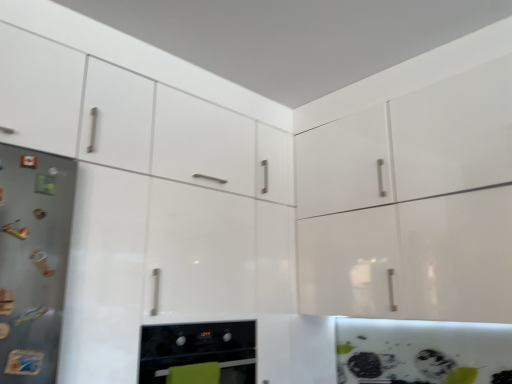
The image size is (512, 384). What do you see at coordinates (33, 260) in the screenshot?
I see `satin steel refrigerator at left` at bounding box center [33, 260].

Identify the location of satin steel refrigerator at left. (33, 260).

Locate an element on the screen. The height and width of the screenshot is (384, 512). matte black oven at lower center is located at coordinates pyautogui.click(x=199, y=349).

Describe the element at coordinates (199, 349) in the screenshot. I see `matte black oven at lower center` at that location.

Locate an element on the screen. This screenshot has width=512, height=384. satin steel refrigerator at left is located at coordinates (33, 260).

Is satin steel refrigerator at left to the left or to the right of matte black oven at lower center in the image?

Clearly, satin steel refrigerator at left is on the left of matte black oven at lower center in the image.

Between satin steel refrigerator at left and matte black oven at lower center, which one is positioned in front?

satin steel refrigerator at left is in front.

Which point is more distant from viewer, (19, 214) or (253, 326)?

The point (253, 326) is more distant.

From the image's perspective, is satin steel refrigerator at left located above or below matte black oven at lower center?

Clearly, from the image's perspective, satin steel refrigerator at left is above matte black oven at lower center.

From a real-world perspective, is satin steel refrigerator at left over matte black oven at lower center?

Correct, in the physical world, satin steel refrigerator at left is higher than matte black oven at lower center.

Does satin steel refrigerator at left have a lesser width compared to matte black oven at lower center?

Correct, the width of satin steel refrigerator at left is less than that of matte black oven at lower center.

Does satin steel refrigerator at left have a lesser height compared to matte black oven at lower center?

Incorrect, the height of satin steel refrigerator at left does not fall short of that of matte black oven at lower center.

Is satin steel refrigerator at left smaller than matte black oven at lower center?

Correct, satin steel refrigerator at left occupies less space than matte black oven at lower center.

Would you say satin steel refrigerator at left is outside matte black oven at lower center?

satin steel refrigerator at left is positioned outside matte black oven at lower center.

Is satin steel refrigerator at left in contact with matte black oven at lower center?

No, satin steel refrigerator at left is not in contact with matte black oven at lower center.

Does satin steel refrigerator at left turn towards matte black oven at lower center?

No.

The image size is (512, 384). In the image, there is a matte black oven at lower center. What are the coordinates of `appliance above it (from the image's perspective)` in the screenshot? It's located at (33, 260).

Which is more to the right, matte black oven at lower center or satin steel refrigerator at left?

matte black oven at lower center.

Is matte black oven at lower center further to the viewer compared to satin steel refrigerator at left?

Yes, the depth of matte black oven at lower center is greater than that of satin steel refrigerator at left.

Does point (194, 361) appear closer or farther from the camera than point (45, 155)?

Clearly, point (194, 361) is more distant from the camera than point (45, 155).

From the image's perspective, relative to satin steel refrigerator at left, is matte black oven at lower center above or below?

Based on their image positions, matte black oven at lower center is located beneath satin steel refrigerator at left.

From a real-world perspective, is matte black oven at lower center positioned above or below satin steel refrigerator at left?

From a real-world perspective, matte black oven at lower center is physically below satin steel refrigerator at left.

Does matte black oven at lower center have a greater width compared to satin steel refrigerator at left?

Yes, matte black oven at lower center is wider than satin steel refrigerator at left.

Looking at this image, considering the sizes of objects matte black oven at lower center and satin steel refrigerator at left in the image provided, who is taller, matte black oven at lower center or satin steel refrigerator at left?

Standing taller between the two is satin steel refrigerator at left.

Based on their sizes in the image, would you say matte black oven at lower center is bigger or smaller than satin steel refrigerator at left?

Considering their sizes, matte black oven at lower center takes up more space than satin steel refrigerator at left.

Would you say matte black oven at lower center is outside satin steel refrigerator at left?

matte black oven at lower center is positioned outside satin steel refrigerator at left.

Is matte black oven at lower center with satin steel refrigerator at left?

No, matte black oven at lower center is not next to satin steel refrigerator at left.

Is satin steel refrigerator at left at the back of matte black oven at lower center?

matte black oven at lower center is not turned away from satin steel refrigerator at left.

Can you tell me how much matte black oven at lower center and satin steel refrigerator at left differ in facing direction?

The facing directions of matte black oven at lower center and satin steel refrigerator at left are 2.38 degrees apart.

Find the location of a particular element. The width and height of the screenshot is (512, 384). appliance in front of the matte black oven at lower center is located at coordinates (33, 260).

This screenshot has width=512, height=384. What are the coordinates of `home appliance below the satin steel refrigerator at left (from the image's perspective)` in the screenshot? It's located at (199, 349).

The height and width of the screenshot is (384, 512). Find the location of `home appliance that appears on the right of satin steel refrigerator at left`. home appliance that appears on the right of satin steel refrigerator at left is located at coordinates (199, 349).